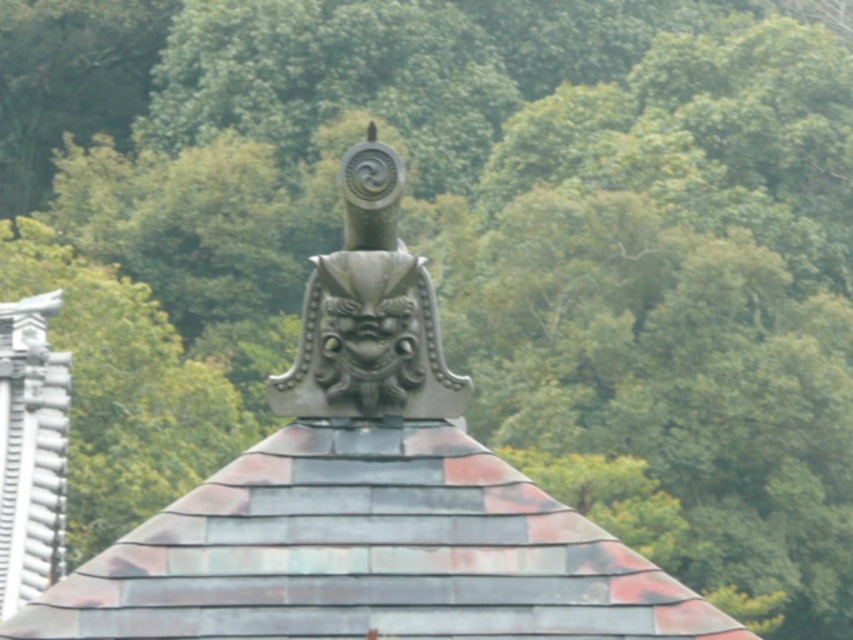
From the picture: You are an architect examining the roof of a traditional Japanese building. You notice the shiny copper tiles at center and the metallic gray dragon head at center. Which object is positioned higher on the roof?

The metallic gray dragon head at center is positioned higher on the roof than the shiny copper tiles at center.

You are an architect examining the roof of a traditional Japanese building. You notice the shiny copper tiles at center and the metallic gray dragon head at center. Which object is positioned closer to you?

The shiny copper tiles at center are closer to the viewer than the metallic gray dragon head at center.